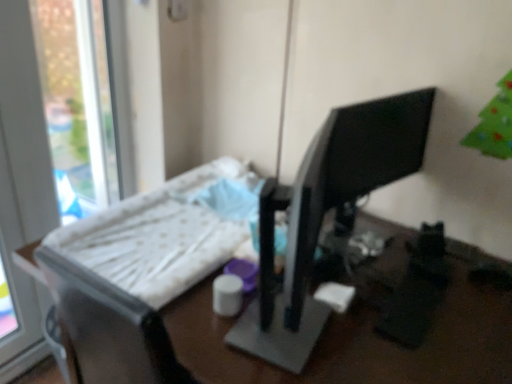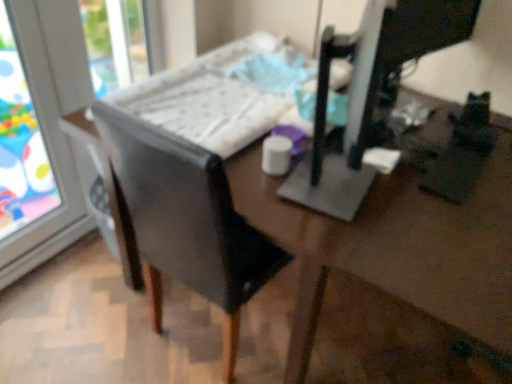
Question: Which way did the camera rotate in the video?

Choices:
 (A) rotated downward
 (B) rotated upward

Answer: (A)